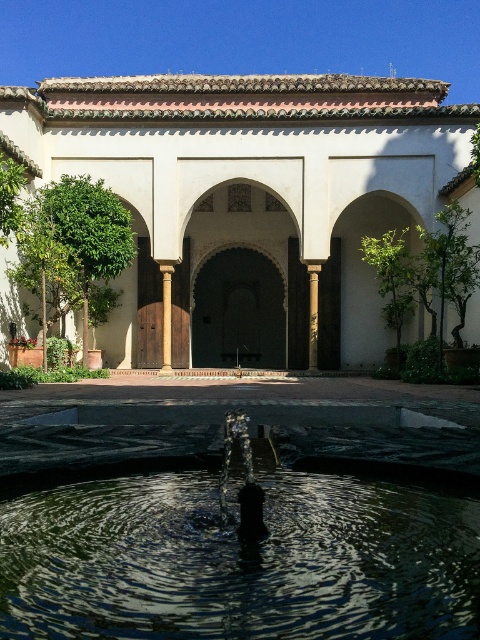
You are standing in the courtyard and want to walk from the central fountain to the large dark wooden door. There are two points marked on the path. Which point, point (217,348) or point (164,301), is closer to the fountain?

Point (217,348) is closer to the fountain because it is further to the viewer than point (164,301), meaning it is nearer to the starting point at the fountain.

You are an architect designing a new courtyard and want to ensure the clear glass fountain at center and the white stone archway at center are proportionate. Based on the scene, which object is wider?

The clear glass fountain at center is wider than the white stone archway at center according to the description.

You are standing in the courtyard and want to walk through the archway. Which archway should you approach first, the dark stone archway at center or the white stone archway at center?

You should approach the dark stone archway at center first because the white stone archway at center is behind it, making the dark stone archway at center the one closer to you.